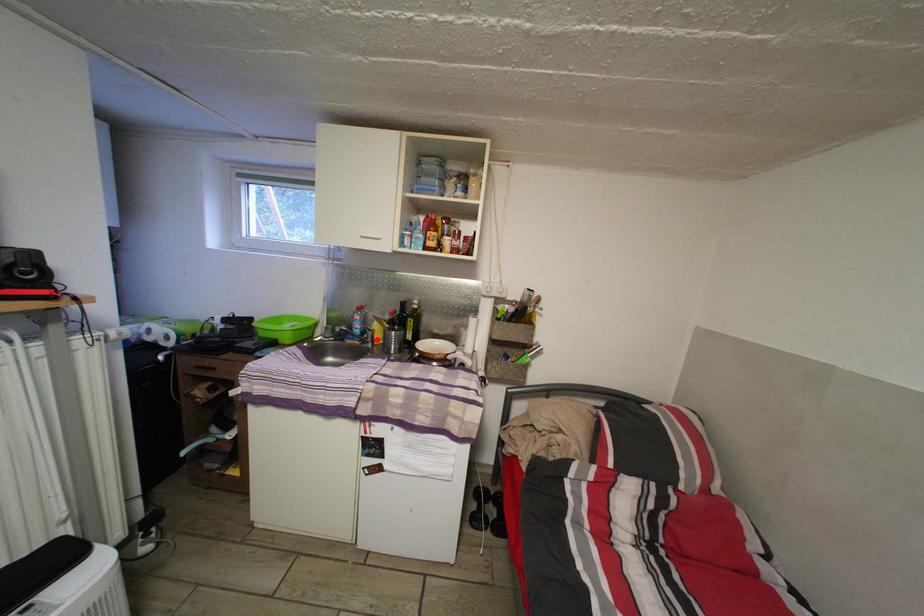
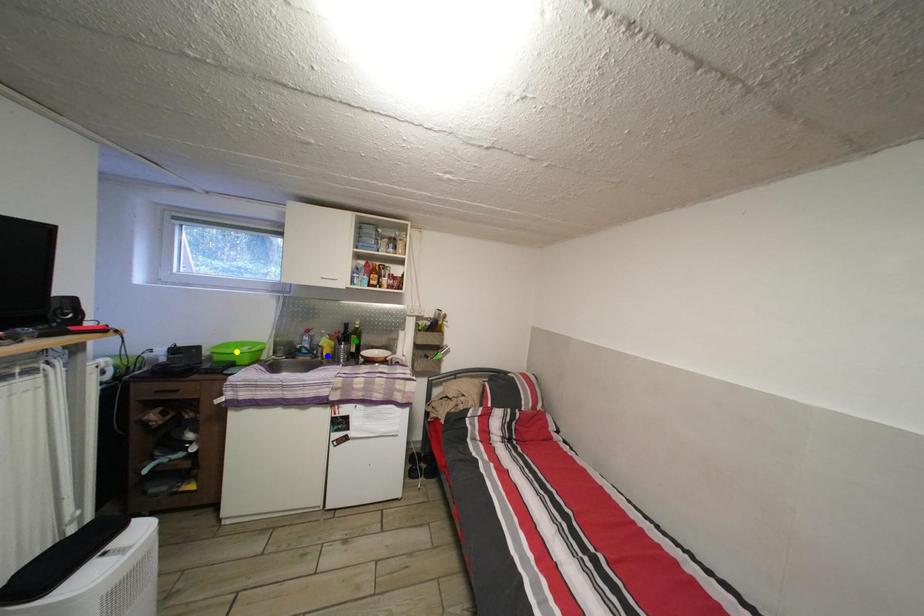
Question: I am providing you with two images of the same scene from different viewpoints. A red point is marked on the first image. You are given multiple points on the second image. Which spot in image 2 lines up with the point in image 1?

Choices:
 (A) blue point
 (B) yellow point
 (C) green point

Answer: (A)